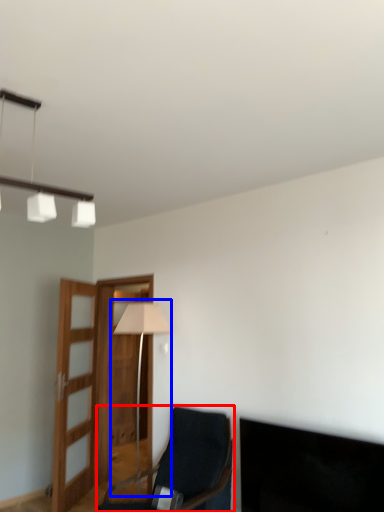
Question: Which of the following is the farthest to the observer, chair (highlighted by a red box) or table lamp (highlighted by a blue box)?

Choices:
 (A) chair
 (B) table lamp

Answer: (B)